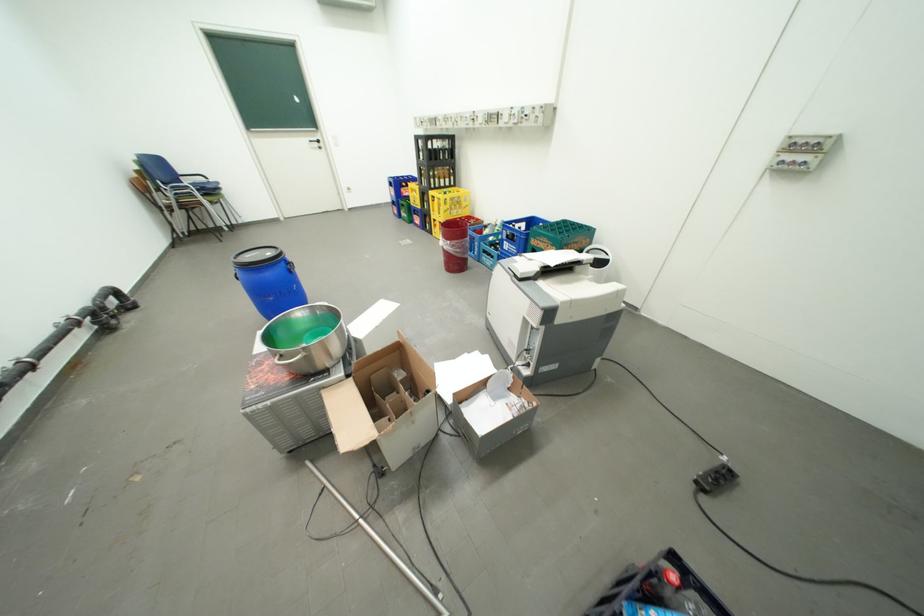
What do you see at coordinates (287, 361) in the screenshot? The height and width of the screenshot is (616, 924). I see `a metal pot handle` at bounding box center [287, 361].